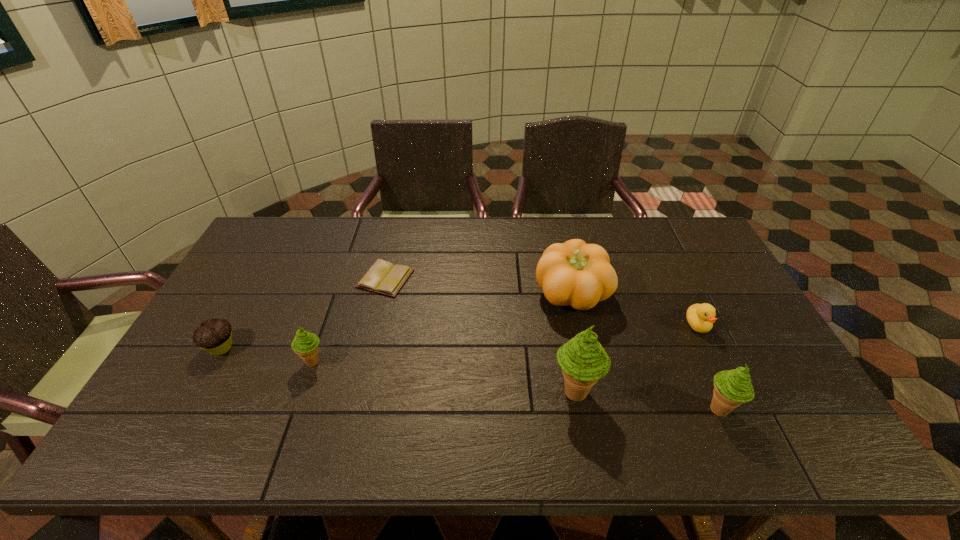
To achieve uniform spacing by inserting another icecream among them, please point to a free space for this new icecream. Please provide its 2D coordinates. Your answer should be formatted as a tuple, i.e. [(x, y)], where the tuple contains the x and y coordinates of a point satisfying the conditions above.

[(440, 376)]